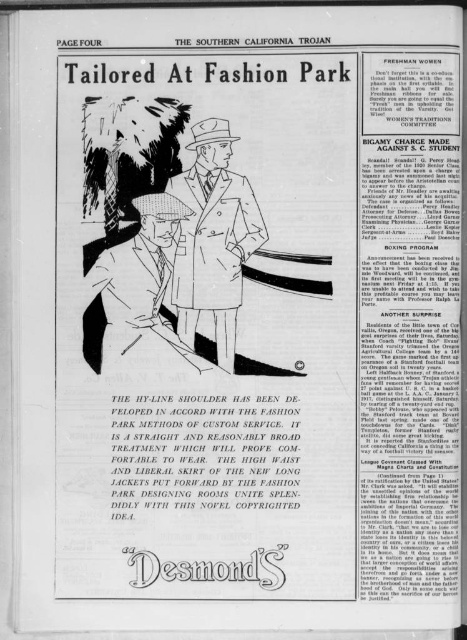
Image resolution: width=467 pixels, height=640 pixels. Find the location of `light brown striped suit at center`. light brown striped suit at center is located at coordinates (212, 240).

Measure the distance between light brown striped suit at center and camera.

They are 3.59 feet apart.

Is point (233, 212) closer to camera compared to point (98, 324)?

Yes, it is.

What are the coordinates of `light brown striped suit at center` in the screenshot? It's located at (212, 240).